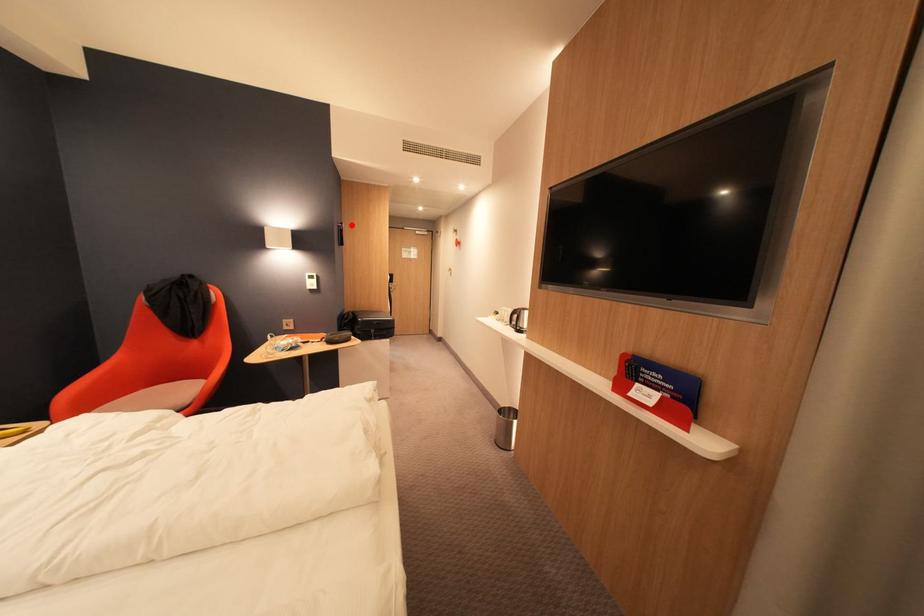
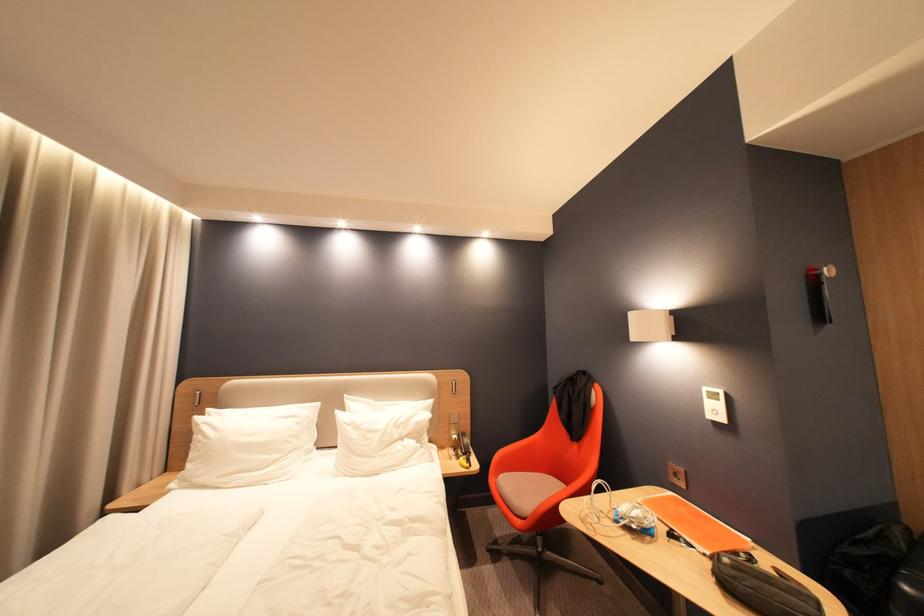
Where in the second image is the point corresponding to the highlighted location from the first image?

(830, 270)